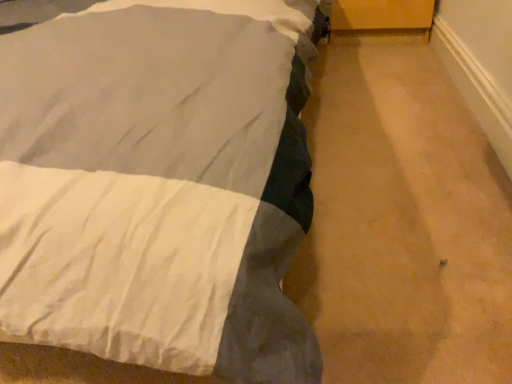
Measure the distance between point (166, 105) and camera.

The distance of point (166, 105) from camera is 15.55 inches.

In order to face white fabric bed at left, should I rotate leftwards or rightwards?

A 8.652 degree turn to the right will do.

What do you see at coordinates (159, 186) in the screenshot?
I see `white fabric bed at left` at bounding box center [159, 186].

What are the coordinates of `white fabric bed at left` in the screenshot? It's located at pos(159,186).

The width and height of the screenshot is (512, 384). Find the location of `white fabric bed at left`. white fabric bed at left is located at coordinates (159, 186).